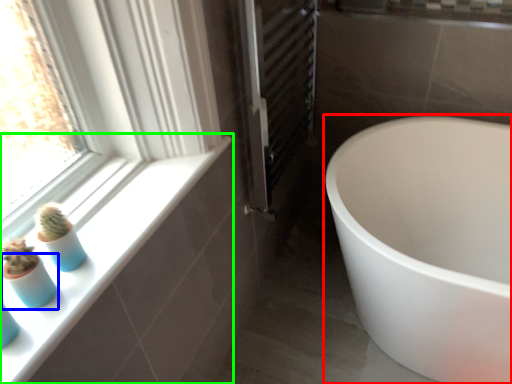
Question: Which object is positioned farthest from bathtub (highlighted by a red box)? Select from glass vase (highlighted by a blue box) and window sill (highlighted by a green box).

Choices:
 (A) glass vase
 (B) window sill

Answer: (A)